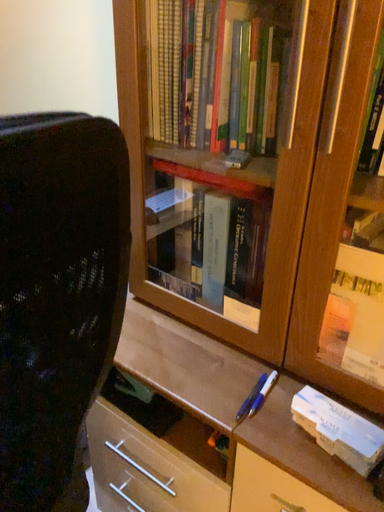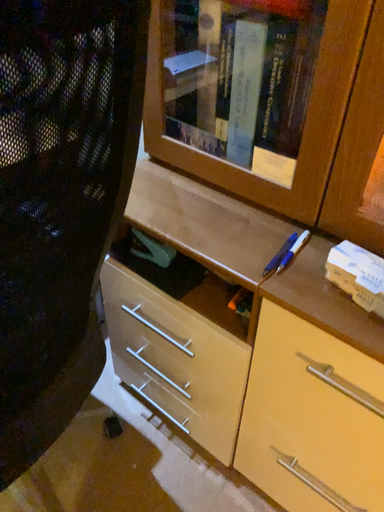
Question: How did the camera likely rotate when shooting the video?

Choices:
 (A) rotated upward
 (B) rotated downward

Answer: (B)